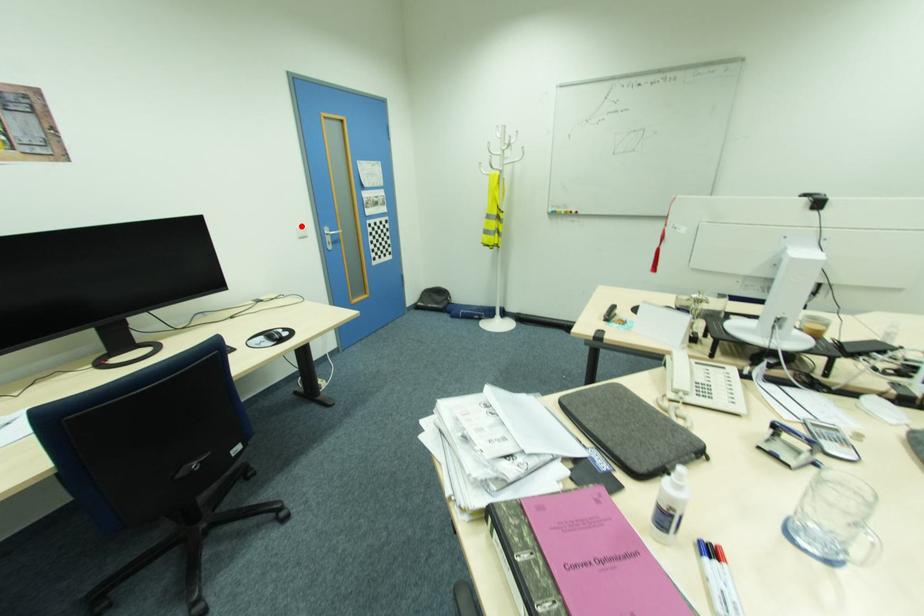
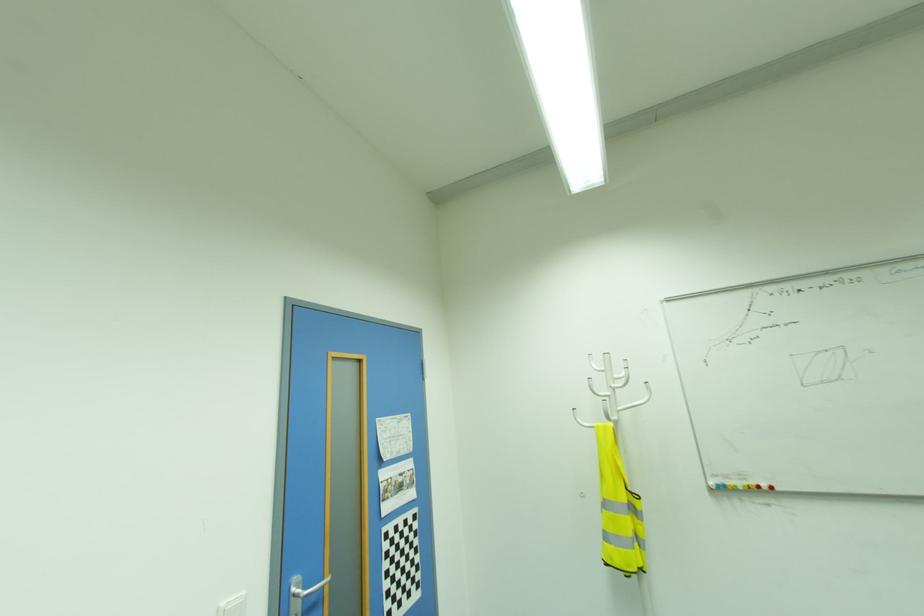
In the second image, find the point that corresponds to the highlighted location in the first image.

(226, 602)